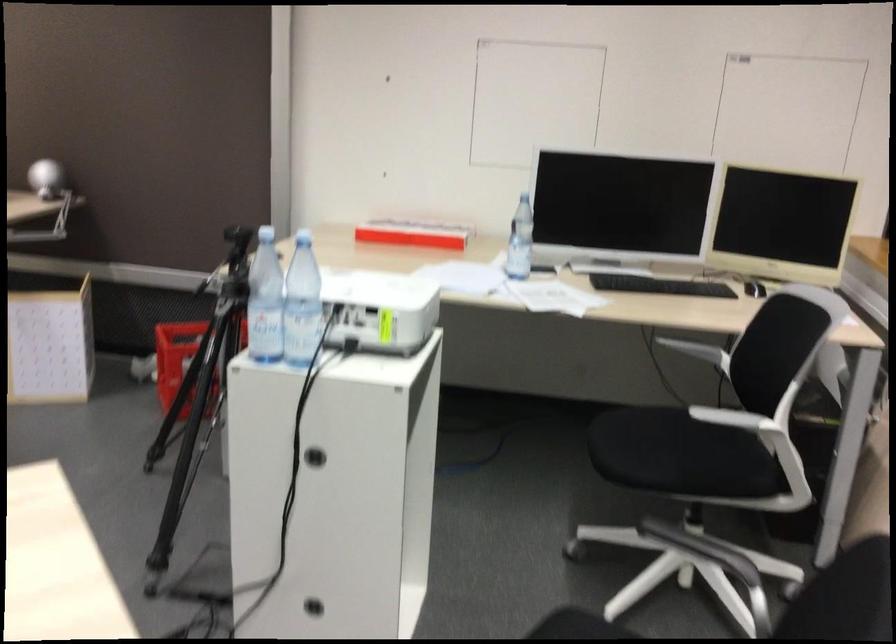
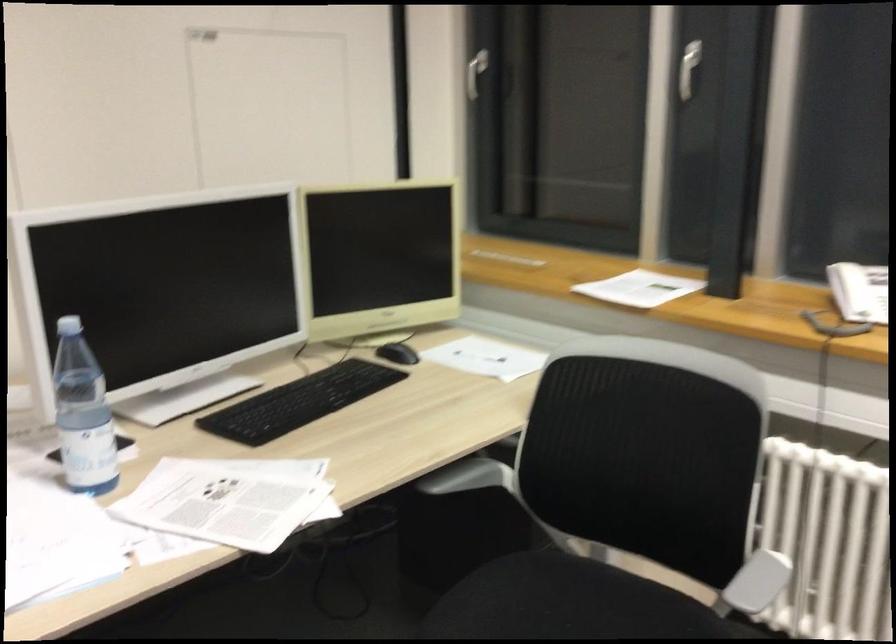
The point at (x=703, y=442) is marked in the first image. Where is the corresponding point in the second image?

(570, 603)